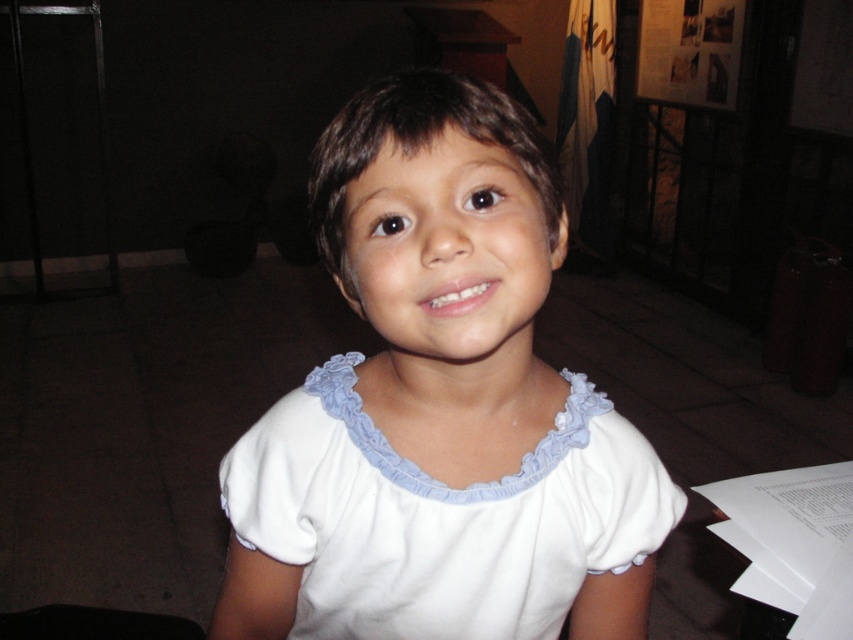
The child is wearing a white cotton shirt at center and a white cotton dress at center. Which clothing item is taller?

The white cotton shirt at center is taller than the white cotton dress at center.

You are a photographer trying to capture the child in the center wearing a white blouse with light blue ruffled trim. The scene has a point marked at coordinates (440, 406). Where is this point located in relation to the child?

The point at (440, 406) is located on the white cotton shirt at center, which is the child wearing the white blouse with light blue ruffled trim.

The child is wearing a white cotton shirt at center and a white cotton dress at center. Which clothing item is closer to you?

The white cotton shirt at center is closer to the viewer than the white cotton dress at center.